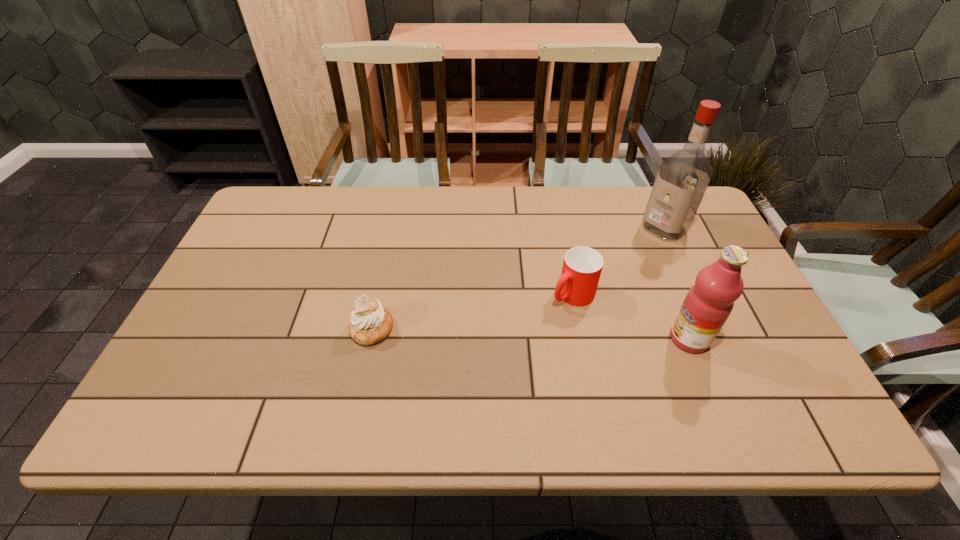
You are a GUI agent. You are given a task and a screenshot of the screen. Output one action in this format:
    pyautogui.click(x=<x>, y=<y>)
    Task: Click on the vacant area situated 0.090m on the label of the fruit juice
    Image resolution: width=960 pixels, height=540 pixels.
    Given the screenshot: What is the action you would take?
    pyautogui.click(x=633, y=339)

Where is `vacant space situated on the front-facing side of the farthest object`? The height and width of the screenshot is (540, 960). vacant space situated on the front-facing side of the farthest object is located at coordinates click(x=604, y=274).

Where is `free region located on the front-facing side of the farthest object`? free region located on the front-facing side of the farthest object is located at coordinates (606, 273).

The width and height of the screenshot is (960, 540). Identify the location of free spot located 0.080m on the front-facing side of the farthest object. (636, 250).

Where is `vacant space located on the side of the third nearest object with the handle`? The height and width of the screenshot is (540, 960). vacant space located on the side of the third nearest object with the handle is located at coordinates (509, 334).

I want to click on free space located on the side of the third nearest object with the handle, so click(483, 351).

Where is `free region located on the side of the third nearest object with the handle`? free region located on the side of the third nearest object with the handle is located at coordinates (467, 362).

Find the location of a particular element. object present at the far edge is located at coordinates (682, 179).

In order to click on fruit juice at the right edge in this screenshot , I will do `click(706, 307)`.

This screenshot has width=960, height=540. In order to click on liquor at the right edge in this screenshot , I will do `click(682, 179)`.